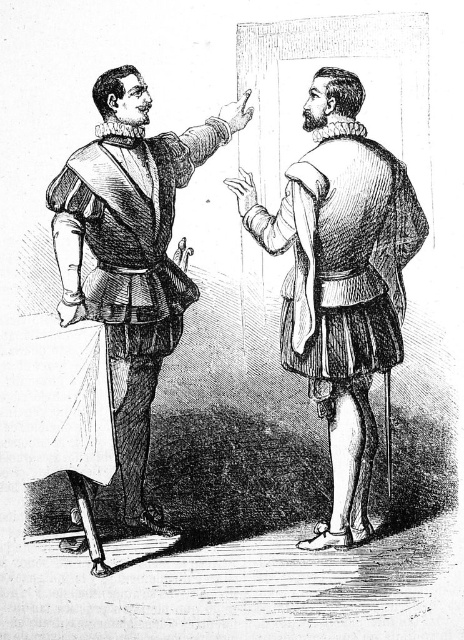
You are an art conservator examining the Renaissance painting. You notice the etched paper robe at center and the matte black armor at left. Which object takes up more area in the painting?

The matte black armor at left occupies more space than the etched paper robe at center.